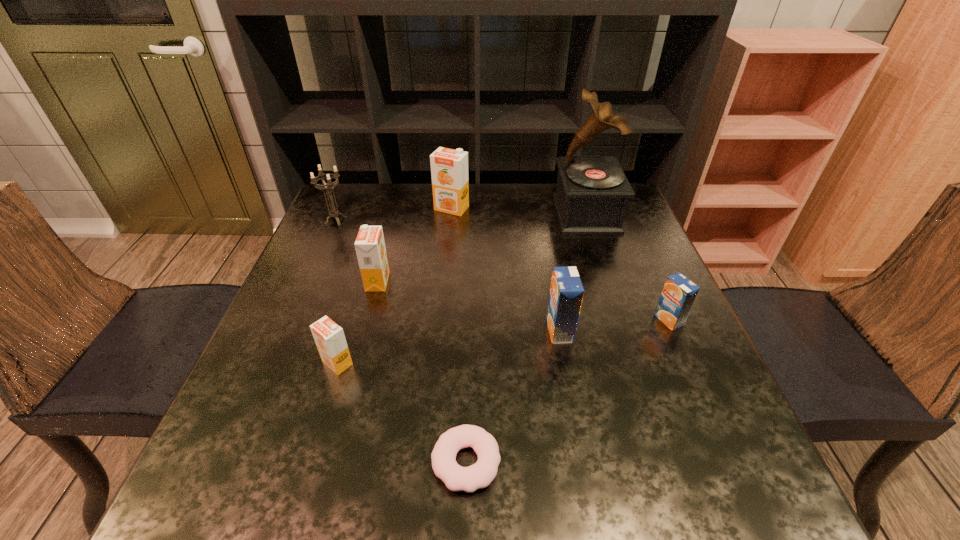
The width and height of the screenshot is (960, 540). I want to click on the fourth closest orange juice to the smaller blue orange_juice, so click(329, 337).

The image size is (960, 540). In order to click on the fourth closest orange juice relative to the candle holder in this screenshot , I will do `click(566, 294)`.

I want to click on the third closest orange orange juice to the leftmost object, so click(329, 337).

The height and width of the screenshot is (540, 960). In order to click on orange orange juice that is the second closest to the second farthest orange orange juice in this screenshot , I will do `click(449, 168)`.

Find the location of `free space that satisfies the following two spatial constraints: 1. on the back side of the second orange juice from right to left; 2. on the left side of the right blue orange_juice`. free space that satisfies the following two spatial constraints: 1. on the back side of the second orange juice from right to left; 2. on the left side of the right blue orange_juice is located at coordinates (558, 320).

The width and height of the screenshot is (960, 540). In order to click on vacant space that satisfies the following two spatial constraints: 1. on the back side of the smaller blue orange_juice; 2. at the horn opening of the tallest object in this screenshot , I will do 622,214.

Image resolution: width=960 pixels, height=540 pixels. What are the coordinates of `free space that satisfies the following two spatial constraints: 1. at the horn opening of the smaller blue orange_juice; 2. on the right side of the phonograph_record` in the screenshot? It's located at (621, 320).

Find the location of a particular element. The image size is (960, 540). vacant space that satisfies the following two spatial constraints: 1. at the horn opening of the tallest object; 2. on the front side of the second smallest orange orange juice is located at coordinates (609, 282).

The width and height of the screenshot is (960, 540). In order to click on vacant space that satisfies the following two spatial constraints: 1. on the front side of the rightmost orange juice; 2. on the left side of the candle holder in this screenshot , I will do `click(292, 320)`.

Image resolution: width=960 pixels, height=540 pixels. Find the location of `blank area in the image that satisfies the following two spatial constraints: 1. at the horn opening of the phonograph_record; 2. on the front side of the smallest orange orange juice`. blank area in the image that satisfies the following two spatial constraints: 1. at the horn opening of the phonograph_record; 2. on the front side of the smallest orange orange juice is located at coordinates (636, 363).